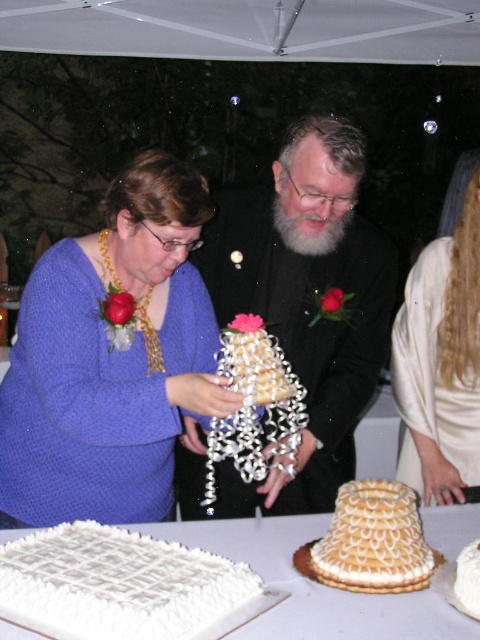
Question: In this image, where is smooth black jacket at center located relative to white textured cake at center?

Choices:
 (A) above
 (B) below

Answer: (A)

Question: Does smooth black jacket at center appear on the right side of white textured cake at center?

Choices:
 (A) yes
 (B) no

Answer: (B)

Question: Which of these objects is positioned farthest from the satin white dress at lower right?

Choices:
 (A) golden textured cake at center
 (B) white frosted cake at center
 (C) matte gold necklace at center
 (D) smooth black jacket at center

Answer: (A)

Question: Can you confirm if satin white dress at lower right is bigger than white frosted cake at center?

Choices:
 (A) yes
 (B) no

Answer: (A)

Question: Which point appears farthest from the camera in this image?

Choices:
 (A) (165, 385)
 (B) (346, 454)

Answer: (B)

Question: Which object is positioned closest to the satin white dress at lower right?

Choices:
 (A) white textured cake at center
 (B) white frosted cake at center
 (C) smooth black jacket at center

Answer: (C)